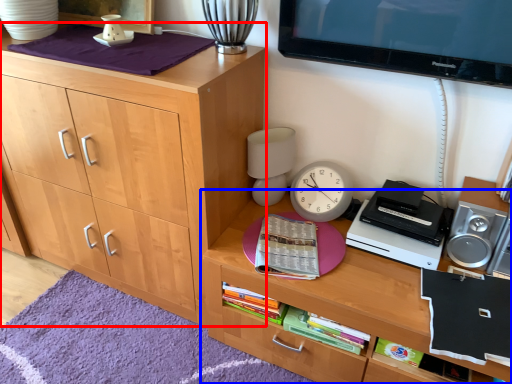
Question: Among these objects, which one is nearest to the camera, cabinetry (highlighted by a red box) or desk (highlighted by a blue box)?

Choices:
 (A) cabinetry
 (B) desk

Answer: (B)